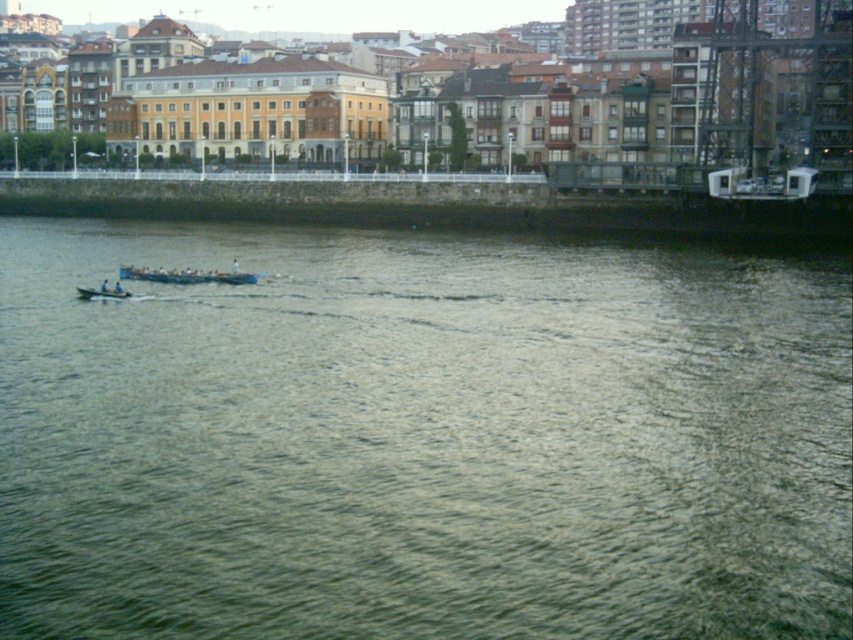
You are standing on the riverside and want to board the closest boat to you. Which boat should you choose between the blue glossy rowboat at center and the blue plastic boat at center?

The blue glossy rowboat at center is closer to you since it is only 5.59 meters away from the blue plastic boat at center, meaning it is nearer than the latter.

You are standing at the point with coordinates point (419, 436). Looking towards the green water at lower left, which direction should you face to see the buildings in the background?

The point (419, 436) is located at the green water at lower left. To see the buildings in the background, you should look towards the opposite direction of the green water at lower left, which would be towards the upper right.

You are standing on the riverside and want to take a photo of the blue plastic boat at center and the green water at lower left. Which object is closer to the camera?

The blue plastic boat at center is closer to the camera than the green water at lower left because the green water at lower left is located below it.